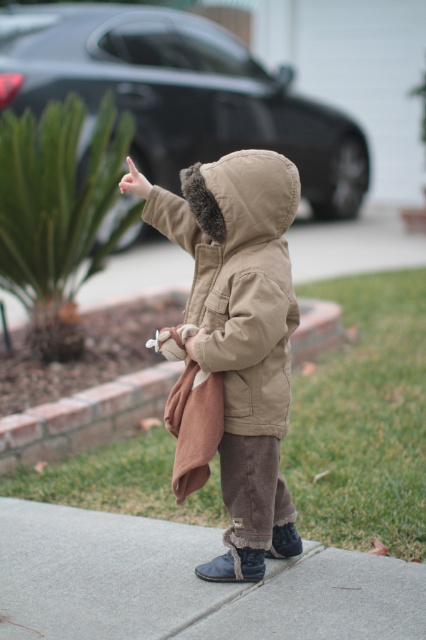
The child is pointing upwards with their right hand. Based on the scene, which object is closer to the child? The brown fabric at center or the light skin tone flesh at upper center?

The light skin tone flesh at upper center is closer to the child because it is located above the brown fabric at center.

You are a delivery person trying to deliver a package to the house in the image. The GPS says to drop the package on the gray concrete sidewalk at lower center. Where should you place the package?

→ You should place the package at the gray concrete sidewalk at lower center located at point coordinates of (189, 582).

You are a photographer trying to capture the child in the scene. You notice two points marked in the image. The first point is at coordinates point (245,380) and the second is at point (146,179). Which point is closer to the camera lens?

→ Point (245,380) is closer to the viewer than point (146,179), so the first point is closer to the camera lens.